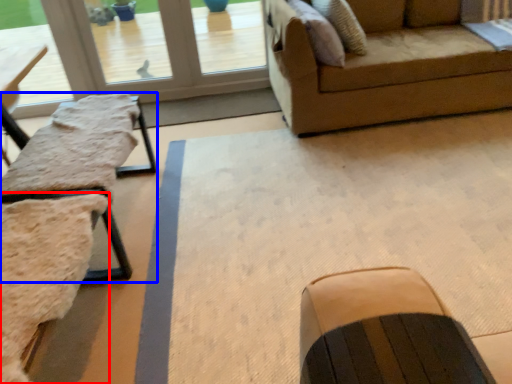
Question: Which of the following is the farthest to the observer, swivel chair (highlighted by a red box) or table (highlighted by a blue box)?

Choices:
 (A) swivel chair
 (B) table

Answer: (B)